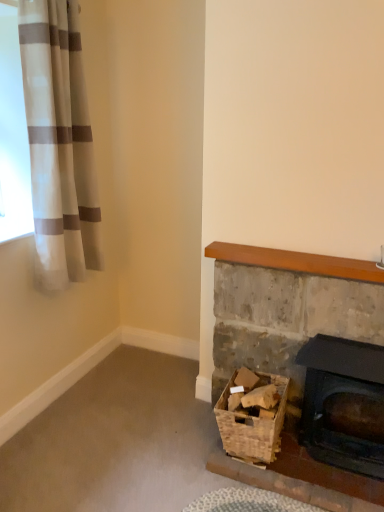
Question: Considering the positions of woven brown basket at lower right and rustic stone fireplace at lower right, which is the 1th fireplace from left to right, in the image, is woven brown basket at lower right taller or shorter than rustic stone fireplace at lower right, which is the 1th fireplace from left to right,?

Choices:
 (A) short
 (B) tall

Answer: (A)

Question: In terms of size, does woven brown basket at lower right appear bigger or smaller than rustic stone fireplace at lower right, which is the 1th fireplace from left to right?

Choices:
 (A) small
 (B) big

Answer: (A)

Question: Estimate the real-world distances between objects in this image. Which object is farther from the white striped fabric at upper left?

Choices:
 (A) rustic stone fireplace at lower right, which is the 1th fireplace from left to right
 (B) woven brown basket at lower right
 (C) matte black fireplace at lower right, the first fireplace in the right-to-left sequence

Answer: (C)

Question: Based on their relative distances, which object is nearer to the white striped fabric at upper left?

Choices:
 (A) rustic stone fireplace at lower right, marked as the second fireplace in a right-to-left arrangement
 (B) woven brown basket at lower right
 (C) matte black fireplace at lower right, the first fireplace in the right-to-left sequence

Answer: (A)